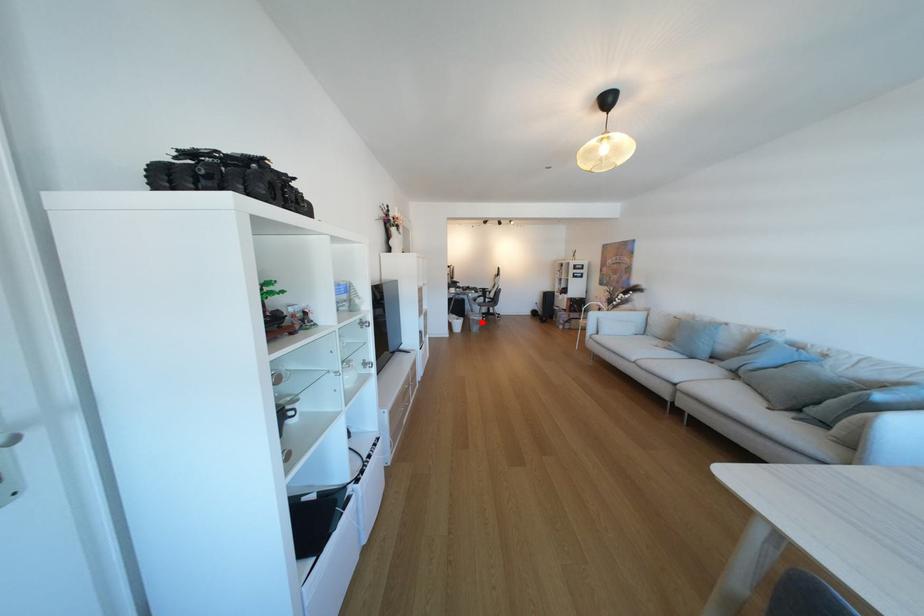
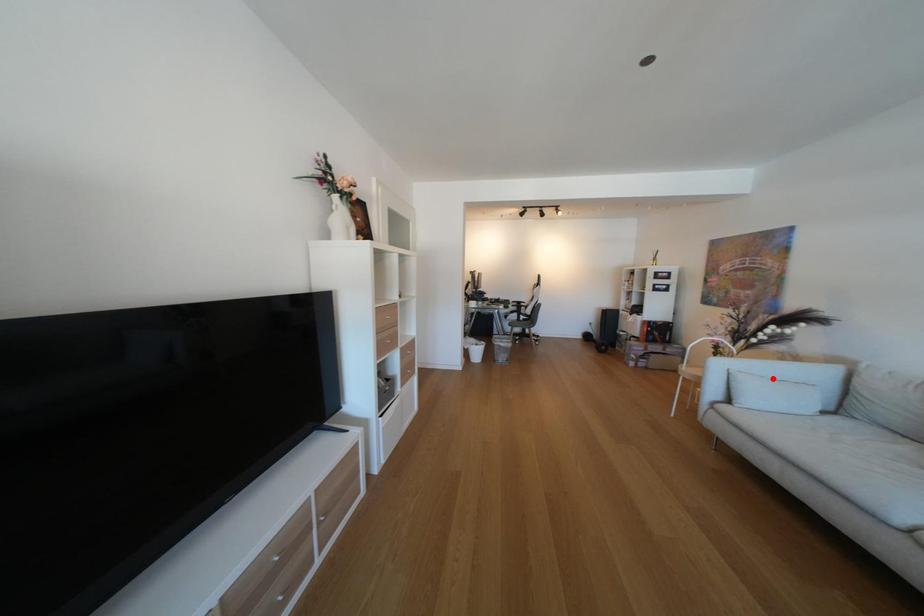
I am providing you with two images of the same scene from different viewpoints. A red point is marked on the first image and another point is marked on the second image. Do the highlighted points in image1 and image2 indicate the same real-world spot?

No